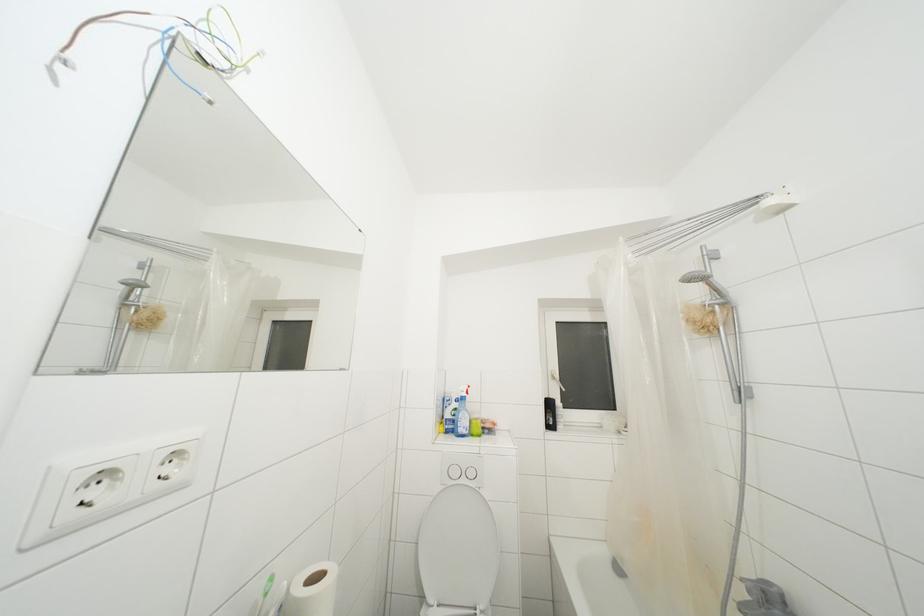
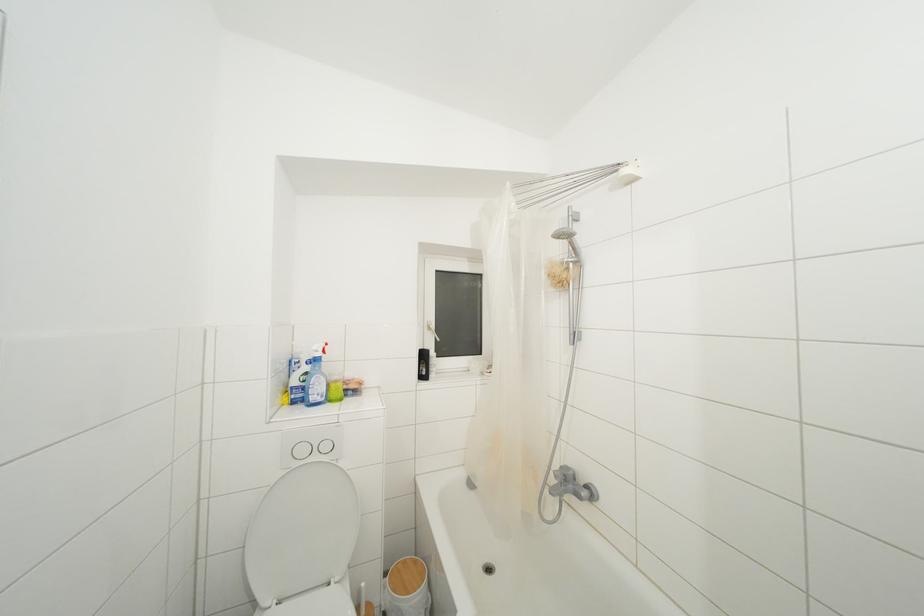
Where in the second image is the point corresponding to point 721,294 from the first image?

(578, 254)